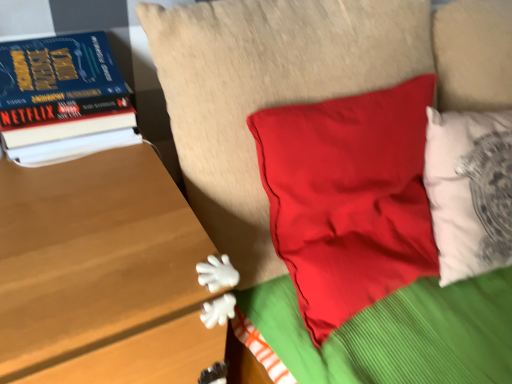
The width and height of the screenshot is (512, 384). Identify the location of wooden table at left. (101, 274).

Does matte red pillow at center turn towards hardcover book at left?

No, matte red pillow at center is not facing towards hardcover book at left.

Which object is further away from the camera taking this photo, matte red pillow at center or hardcover book at left?

Positioned behind is hardcover book at left.

Who is shorter, matte red pillow at center or hardcover book at left?

hardcover book at left is shorter.

From the image's perspective, is matte red pillow at center above wooden table at left?

Indeed, from the image's perspective, matte red pillow at center is shown above wooden table at left.

How many degrees apart are the facing directions of matte red pillow at center and wooden table at left?

There is a 1.65-degree angle between the facing directions of matte red pillow at center and wooden table at left.

Is matte red pillow at center taller than wooden table at left?

In fact, matte red pillow at center may be shorter than wooden table at left.

Is matte red pillow at center far from wooden table at left?

No, there isn't a large distance between matte red pillow at center and wooden table at left.

Is matte red pillow at center surrounded by wooden table at left?

No, matte red pillow at center is not a part of wooden table at left.

From the image's perspective, does wooden table at left appear lower than matte red pillow at center?

Indeed, from the image's perspective, wooden table at left is shown beneath matte red pillow at center.

From a real-world perspective, is wooden table at left positioned under matte red pillow at center based on gravity?

Yes, from a real-world perspective, wooden table at left is under matte red pillow at center.

Who is taller, hardcover book at left or matte red pillow at center?

matte red pillow at center is taller.

Does hardcover book at left turn towards matte red pillow at center?

No, hardcover book at left is not aimed at matte red pillow at center.

Considering the relative sizes of hardcover book at left and matte red pillow at center in the image provided, is hardcover book at left smaller than matte red pillow at center?

Correct, hardcover book at left occupies less space than matte red pillow at center.

Between hardcover book at left and matte red pillow at center, which one appears on the right side from the viewer's perspective?

matte red pillow at center.

From the picture: Is wooden table at left spatially inside hardcover book at left, or outside of it?

wooden table at left cannot be found inside hardcover book at left.

Does point (46, 328) appear closer or farther from the camera than point (5, 73)?

Point (46, 328).

How much distance is there between wooden table at left and hardcover book at left?

8.05 inches.

Where is `table that is in front of the hardcover book at left`? This screenshot has width=512, height=384. table that is in front of the hardcover book at left is located at coordinates (101, 274).

From a real-world perspective, between hardcover book at left and wooden table at left, who is vertically higher?

hardcover book at left.

Is hardcover book at left located outside wooden table at left?

Yes, hardcover book at left is not within wooden table at left.

Relative to wooden table at left, is hardcover book at left in front or behind?

In the image, hardcover book at left appears behind wooden table at left.

Consider the image. Which point is more forward, (94, 128) or (80, 288)?

The point (80, 288) is closer to the camera.

In order to click on pillow beneath the hardcover book at left (from a real-world perspective) in this screenshot , I will do pyautogui.click(x=267, y=92).

This screenshot has height=384, width=512. I want to click on table in front of the matte red pillow at center, so click(101, 274).

Looking at the image, which one is located closer to hardcover book at left, matte red pillow at center or wooden table at left?

wooden table at left is closer to hardcover book at left.

Looking at the image, which one is located closer to wooden table at left, matte red pillow at center or hardcover book at left?

hardcover book at left.

When comparing their distances from wooden table at left, does hardcover book at left or matte red pillow at center seem closer?

hardcover book at left is closer to wooden table at left.

Considering their positions, is wooden table at left positioned closer to hardcover book at left than matte red pillow at center?

wooden table at left.

Estimate the real-world distances between objects in this image. Which object is further from matte red pillow at center, hardcover book at left or wooden table at left?

wooden table at left is positioned further to the anchor matte red pillow at center.

When comparing their distances from matte red pillow at center, does wooden table at left or hardcover book at left seem further?

wooden table at left is positioned further to the anchor matte red pillow at center.

At what (x,y) coordinates should I click in order to perform the action: click on book situated between wooden table at left and matte red pillow at center from left to right. Please return your answer as a coordinate pair (x, y). Looking at the image, I should click on (63, 99).